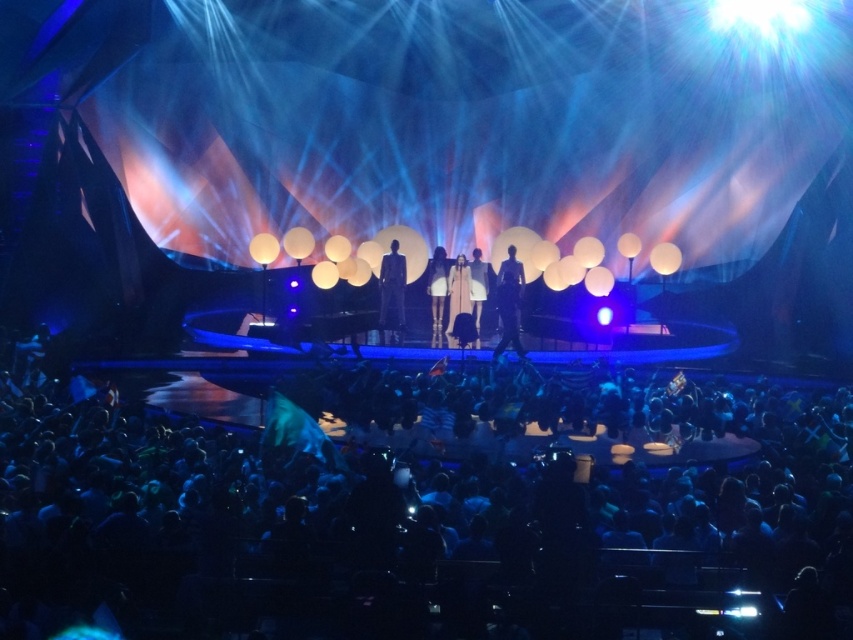
Where is `black fabric crowd at lower center`? The height and width of the screenshot is (640, 853). black fabric crowd at lower center is located at coordinates (421, 522).

Between black fabric crowd at lower center and white leather boots at center, which one is positioned lower?

black fabric crowd at lower center

Locate an element on the screen. Image resolution: width=853 pixels, height=640 pixels. black fabric crowd at lower center is located at coordinates click(x=421, y=522).

Is black fabric crowd at lower center positioned before silky white dress at center?

Yes, black fabric crowd at lower center is in front of silky white dress at center.

This screenshot has height=640, width=853. What do you see at coordinates (421, 522) in the screenshot?
I see `black fabric crowd at lower center` at bounding box center [421, 522].

Which is behind, point (283, 417) or point (459, 264)?

Point (459, 264)

Identify the location of black fabric crowd at lower center. The height and width of the screenshot is (640, 853). (421, 522).

Which is more to the right, matte black suit at center or silky white dress at center?

silky white dress at center

Is matte black suit at center further to the viewer compared to silky white dress at center?

No, it is not.

Between point (398, 257) and point (467, 307), which one is positioned behind?

Point (467, 307)

This screenshot has width=853, height=640. What are the coordinates of `matte black suit at center` in the screenshot? It's located at (392, 296).